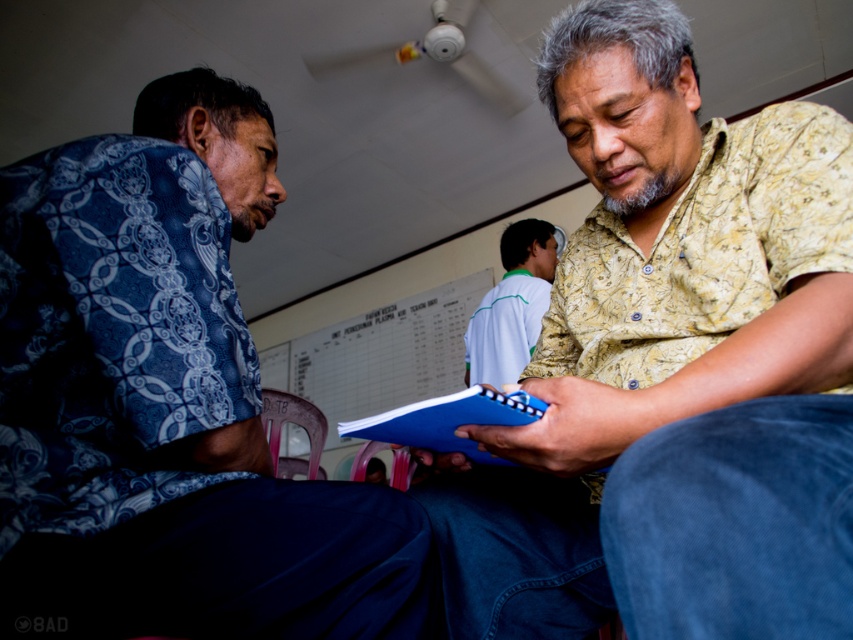
You are a person who needs to place a blue matte notebook at center on top of the plastic chair at lower center. Based on the scene description, will the notebook fit without falling off?

The blue matte notebook at center occupies less space than plastic chair at lower center, so it will fit without falling off.

You are standing in the room and want to move from the point at coordinates point (427, 419) to the point at coordinates point (306, 410). Can you walk directly to the second point without moving around any objects?

Point (427, 419) is in front of point (306, 410), so you can walk directly to the second point without moving around any objects because there are no obstacles blocking the path between them.